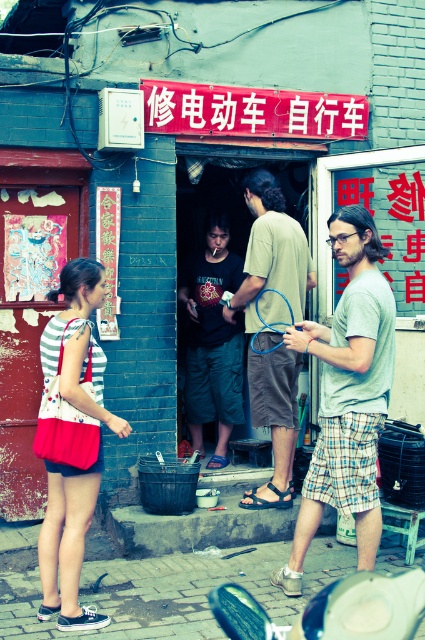
Question: Which point is farther from the camera taking this photo?

Choices:
 (A) (210, 234)
 (B) (81, 387)

Answer: (A)

Question: Does dark blue cotton shorts at center come behind black leather sandal at lower center?

Choices:
 (A) no
 (B) yes

Answer: (B)

Question: Which object is the farthest from the striped fabric dress at center?

Choices:
 (A) brown fabric shorts at center
 (B) dark blue cotton shorts at center
 (C) light gray cotton t-shirt at center

Answer: (B)

Question: Is brown fabric shorts at center to the right of black leather sandal at lower center from the viewer's perspective?

Choices:
 (A) no
 (B) yes

Answer: (B)

Question: Is striped fabric dress at center positioned behind dark blue cotton shorts at center?

Choices:
 (A) yes
 (B) no

Answer: (B)

Question: Which of these objects is positioned farthest from the striped fabric dress at center?

Choices:
 (A) brown fabric shorts at center
 (B) black leather sandal at lower center

Answer: (B)